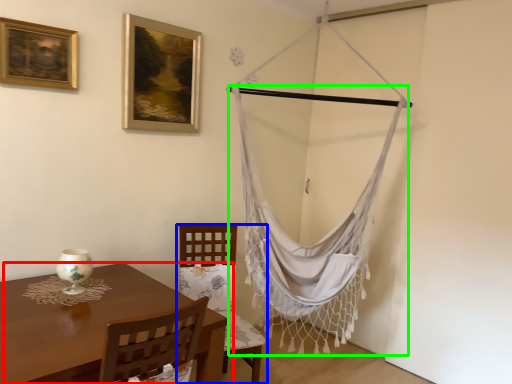
Question: Based on their relative distances, which object is nearer to table (highlighted by a red box)? Choose from chair (highlighted by a blue box) and curtain (highlighted by a green box).

Choices:
 (A) chair
 (B) curtain

Answer: (A)